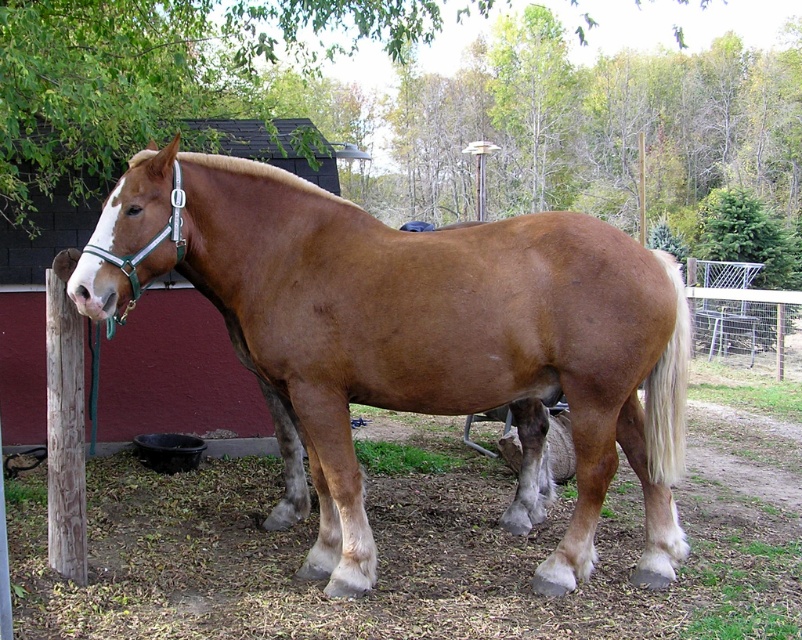
Is point (739, 284) less distant than point (663, 422)?

No, (739, 284) is behind (663, 422).

At what (x,y) coordinates should I click in order to perform the action: click on white wire mesh fence at right. Please return your answer as a coordinate pair (x, y). This screenshot has height=640, width=802. Looking at the image, I should click on (743, 317).

Can you confirm if brown glossy horse at center is smaller than white wire mesh fence at right?

No.

Is the position of brown glossy horse at center more distant than that of white wire mesh fence at right?

No, it is in front of white wire mesh fence at right.

Between point (298, 234) and point (796, 300), which one is positioned in front?

Point (298, 234) is more forward.

Image resolution: width=802 pixels, height=640 pixels. Find the location of `brown glossy horse at center`. brown glossy horse at center is located at coordinates (404, 332).

Does brown glossy horse at center appear over white silky tail at right?

No, brown glossy horse at center is not above white silky tail at right.

Who is taller, brown glossy horse at center or white silky tail at right?

Standing taller between the two is brown glossy horse at center.

Does point (594, 413) come farther from viewer compared to point (670, 369)?

That is False.

What are the coordinates of `brown glossy horse at center` in the screenshot? It's located at point(404,332).